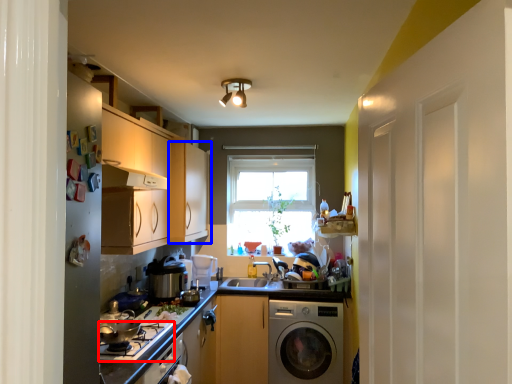
Question: Which object is further to the camera taking this photo, gas stove (highlighted by a red box) or cabinetry (highlighted by a blue box)?

Choices:
 (A) gas stove
 (B) cabinetry

Answer: (B)